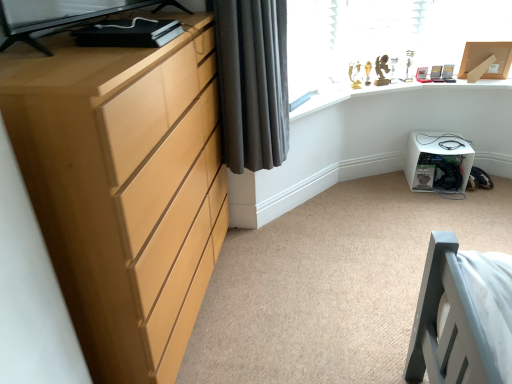
The height and width of the screenshot is (384, 512). Identify the location of gold metallic trophy case at upper right. (387, 93).

You are a GUI agent. You are given a task and a screenshot of the screen. Output one action in this format:
    pyautogui.click(x=<x>, y=<y>)
    Task: Click on the white plastic storage box at lower right
    Image resolution: width=512 pixels, height=384 pixels.
    Given the screenshot: What is the action you would take?
    pyautogui.click(x=438, y=162)

Identify the location of light wood chest of drawers at left. (121, 185).

You are a GUI agent. You are given a task and a screenshot of the screen. Output one action in this format:
    pyautogui.click(x=<x>, y=<y>)
    Task: Click on the dark grey fabric curtain at upper left
    Image resolution: width=512 pixels, height=384 pixels.
    Given the screenshot: What is the action you would take?
    pyautogui.click(x=253, y=82)

From a real-world perspective, does gold metallic trophy case at upper right stand above white plastic storage box at lower right?

Yes, from a real-world perspective, gold metallic trophy case at upper right is above white plastic storage box at lower right.

Does gold metallic trophy case at upper right have a lesser height compared to white plastic storage box at lower right?

Yes.

Could you measure the distance between gold metallic trophy case at upper right and white plastic storage box at lower right?

They are 20.45 inches apart.

Are gold metallic trophy case at upper right and white plastic storage box at lower right beside each other?

No, gold metallic trophy case at upper right is not beside white plastic storage box at lower right.

Does light wood chest of drawers at left have a greater height compared to white plastic storage box at lower right?

Yes.

Which is closer, (92, 266) or (447, 135)?

Positioned in front is point (92, 266).

Do you think light wood chest of drawers at left is within white plastic storage box at lower right, or outside of it?

light wood chest of drawers at left is outside white plastic storage box at lower right.

Considering the sizes of light wood chest of drawers at left and white plastic storage box at lower right in the image, is light wood chest of drawers at left bigger or smaller than white plastic storage box at lower right?

light wood chest of drawers at left is bigger than white plastic storage box at lower right.

Is gold metallic trophy case at upper right in front of light wood chest of drawers at left?

No, gold metallic trophy case at upper right is behind light wood chest of drawers at left.

Considering the relative sizes of gold metallic trophy case at upper right and light wood chest of drawers at left in the image provided, is gold metallic trophy case at upper right taller than light wood chest of drawers at left?

No.

Considering the sizes of gold metallic trophy case at upper right and light wood chest of drawers at left in the image, is gold metallic trophy case at upper right wider or thinner than light wood chest of drawers at left?

Clearly, gold metallic trophy case at upper right has more width compared to light wood chest of drawers at left.

How far apart are light wood chest of drawers at left and dark grey fabric curtain at upper left?

light wood chest of drawers at left and dark grey fabric curtain at upper left are 54.63 centimeters apart.

Are light wood chest of drawers at left and dark grey fabric curtain at upper left located far from each other?

No, there isn't a large distance between light wood chest of drawers at left and dark grey fabric curtain at upper left.

Which object is positioned more to the left, light wood chest of drawers at left or dark grey fabric curtain at upper left?

light wood chest of drawers at left is more to the left.

From the image's perspective, relative to dark grey fabric curtain at upper left, is light wood chest of drawers at left above or below?

From the image's perspective, light wood chest of drawers at left appears below dark grey fabric curtain at upper left.

Is gold metallic trophy case at upper right not inside dark grey fabric curtain at upper left?

Yes, gold metallic trophy case at upper right is located beyond the bounds of dark grey fabric curtain at upper left.

Locate an element on the screen. curtain above the gold metallic trophy case at upper right (from a real-world perspective) is located at coordinates (253, 82).

Could you tell me if gold metallic trophy case at upper right is turned towards dark grey fabric curtain at upper left?

No, gold metallic trophy case at upper right is not turned towards dark grey fabric curtain at upper left.

Considering the relative positions of gold metallic trophy case at upper right and dark grey fabric curtain at upper left in the image provided, is gold metallic trophy case at upper right to the right of dark grey fabric curtain at upper left from the viewer's perspective?

Yes.

Can you confirm if white plastic storage box at lower right is bigger than dark grey fabric curtain at upper left?

No.

Is white plastic storage box at lower right completely or partially outside of dark grey fabric curtain at upper left?

Yes.

Considering the sizes of white plastic storage box at lower right and dark grey fabric curtain at upper left in the image, is white plastic storage box at lower right wider or thinner than dark grey fabric curtain at upper left?

white plastic storage box at lower right is thinner than dark grey fabric curtain at upper left.

From the image's perspective, is white plastic storage box at lower right positioned above or below dark grey fabric curtain at upper left?

Based on their image positions, white plastic storage box at lower right is located beneath dark grey fabric curtain at upper left.

This screenshot has width=512, height=384. Find the location of `chest of drawers on the left of gold metallic trophy case at upper right`. chest of drawers on the left of gold metallic trophy case at upper right is located at coordinates (121, 185).

Can gold metallic trophy case at upper right be found inside light wood chest of drawers at left?

Actually, gold metallic trophy case at upper right is outside light wood chest of drawers at left.

Is light wood chest of drawers at left taller than gold metallic trophy case at upper right?

Indeed, light wood chest of drawers at left has a greater height compared to gold metallic trophy case at upper right.

Locate an element on the screen. cabinetry below the gold metallic trophy case at upper right (from a real-world perspective) is located at coordinates (438, 162).

Locate an element on the screen. The width and height of the screenshot is (512, 384). chest of drawers in front of the white plastic storage box at lower right is located at coordinates (121, 185).

Considering their positions, is light wood chest of drawers at left positioned further to white plastic storage box at lower right than dark grey fabric curtain at upper left?

The object further to white plastic storage box at lower right is light wood chest of drawers at left.

When comparing their distances from gold metallic trophy case at upper right, does white plastic storage box at lower right or light wood chest of drawers at left seem further?

light wood chest of drawers at left.

Which object lies nearer to the anchor point dark grey fabric curtain at upper left, gold metallic trophy case at upper right or light wood chest of drawers at left?

light wood chest of drawers at left.

When comparing their distances from light wood chest of drawers at left, does dark grey fabric curtain at upper left or white plastic storage box at lower right seem closer?

dark grey fabric curtain at upper left is closer to light wood chest of drawers at left.

From the picture: Considering their positions, is gold metallic trophy case at upper right positioned closer to white plastic storage box at lower right than dark grey fabric curtain at upper left?

gold metallic trophy case at upper right lies closer to white plastic storage box at lower right than the other object.

Which object lies further to the anchor point dark grey fabric curtain at upper left, white plastic storage box at lower right or gold metallic trophy case at upper right?

white plastic storage box at lower right lies further to dark grey fabric curtain at upper left than the other object.

From the image, which object appears to be farther from white plastic storage box at lower right, dark grey fabric curtain at upper left or gold metallic trophy case at upper right?

dark grey fabric curtain at upper left is positioned further to the anchor white plastic storage box at lower right.

Based on their spatial positions, is white plastic storage box at lower right or dark grey fabric curtain at upper left further from gold metallic trophy case at upper right?

dark grey fabric curtain at upper left is further to gold metallic trophy case at upper right.

What are the coordinates of `curtain between light wood chest of drawers at left and white plastic storage box at lower right along the z-axis` in the screenshot? It's located at (253, 82).

Identify the location of curtain between light wood chest of drawers at left and gold metallic trophy case at upper right. The width and height of the screenshot is (512, 384). (253, 82).

The height and width of the screenshot is (384, 512). Identify the location of computer desk between light wood chest of drawers at left and white plastic storage box at lower right. (387, 93).

Find the location of a particular element. computer desk located between dark grey fabric curtain at upper left and white plastic storage box at lower right in the left-right direction is located at coordinates (387, 93).